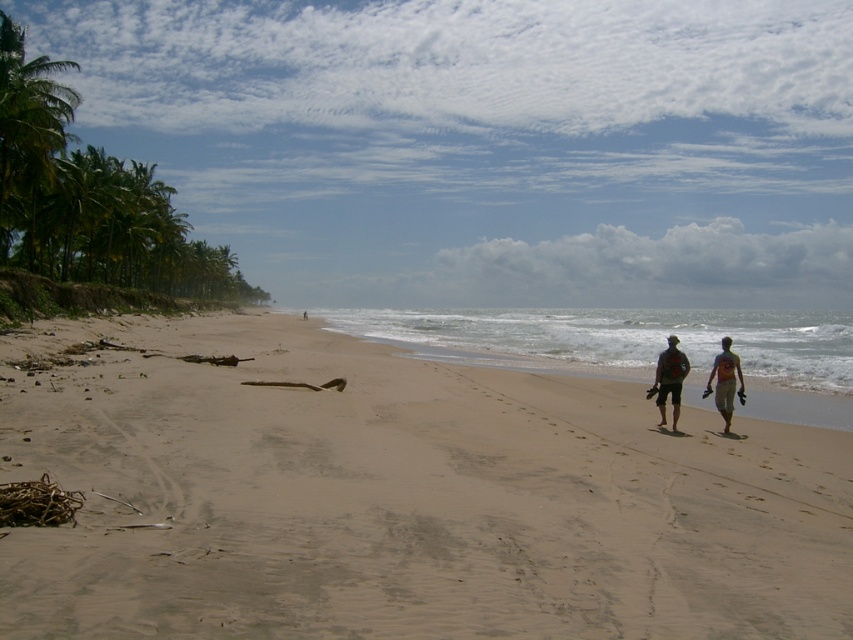
Question: Which object appears closest to the camera in this image?

Choices:
 (A) sandy beach at center
 (B) light blue fabric shorts at lower right

Answer: (A)

Question: Can you confirm if sandy shore at lower center is smaller than dark gray fabric shorts at lower right?

Choices:
 (A) yes
 (B) no

Answer: (B)

Question: Can you confirm if sandy beach at center is positioned above sandy shore at lower center?

Choices:
 (A) no
 (B) yes

Answer: (A)

Question: Which point appears farthest from the camera in this image?

Choices:
 (A) (670, 371)
 (B) (659, 374)

Answer: (B)

Question: Does sandy beach at center have a smaller size compared to matte red shorts at lower right?

Choices:
 (A) yes
 (B) no

Answer: (B)

Question: Based on their relative distances, which object is nearer to the sandy beach at center?

Choices:
 (A) dark gray fabric shorts at lower right
 (B) sandy shore at lower center

Answer: (A)